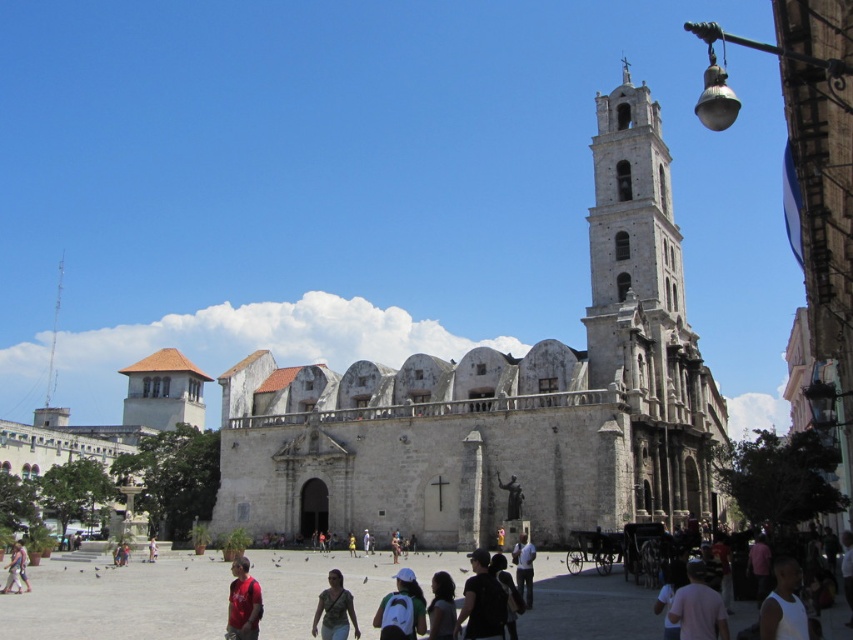
Does dark brown hair at center have a greater height compared to pink fabric dress at center?

Yes, dark brown hair at center is taller than pink fabric dress at center.

Can you confirm if dark brown hair at center is positioned below pink fabric dress at center?

Actually, dark brown hair at center is above pink fabric dress at center.

Which is in front, point (428, 604) or point (149, 544)?

Point (428, 604)

Find the location of a particular element. The width and height of the screenshot is (853, 640). dark brown hair at center is located at coordinates (440, 608).

Measure the distance from white stone church at center to black matte shirt at lower center.

They are 83.36 feet apart.

Is point (231, 429) positioned before point (457, 612)?

No, (231, 429) is behind (457, 612).

Is point (695, 500) positioned behind point (491, 616)?

Yes.

Where is `white stone church at center`? This screenshot has width=853, height=640. white stone church at center is located at coordinates 502,401.

Is pink fabric shirt at lower right shorter than matte gray shirt at center?

Yes, pink fabric shirt at lower right is shorter than matte gray shirt at center.

Does pink fabric shirt at lower right appear under matte gray shirt at center?

No.

In order to click on pink fabric shirt at lower right in this screenshot , I will do `click(698, 605)`.

Image resolution: width=853 pixels, height=640 pixels. In order to click on pink fabric shirt at lower right in this screenshot , I will do `click(698, 605)`.